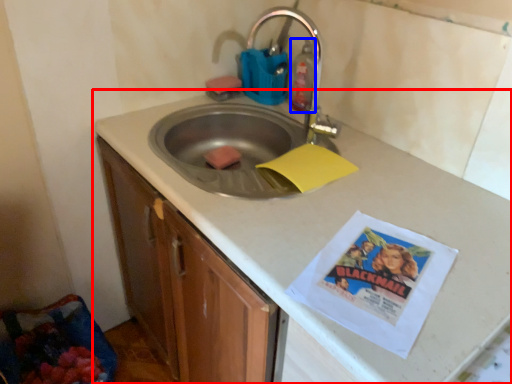
Question: Which object appears farthest to the camera in this image, countertop (highlighted by a red box) or cleaning product (highlighted by a blue box)?

Choices:
 (A) countertop
 (B) cleaning product

Answer: (B)